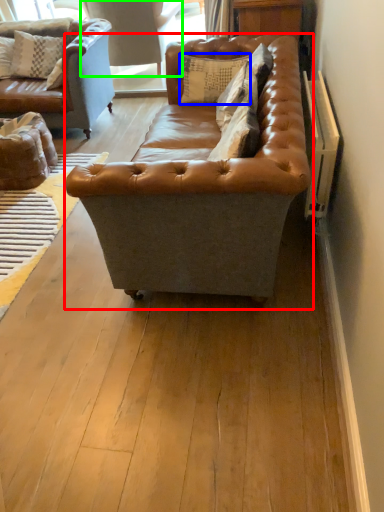
Question: Which is farther away from studio couch (highlighted by a red box)? pillow (highlighted by a blue box) or swivel chair (highlighted by a green box)?

Choices:
 (A) pillow
 (B) swivel chair

Answer: (B)